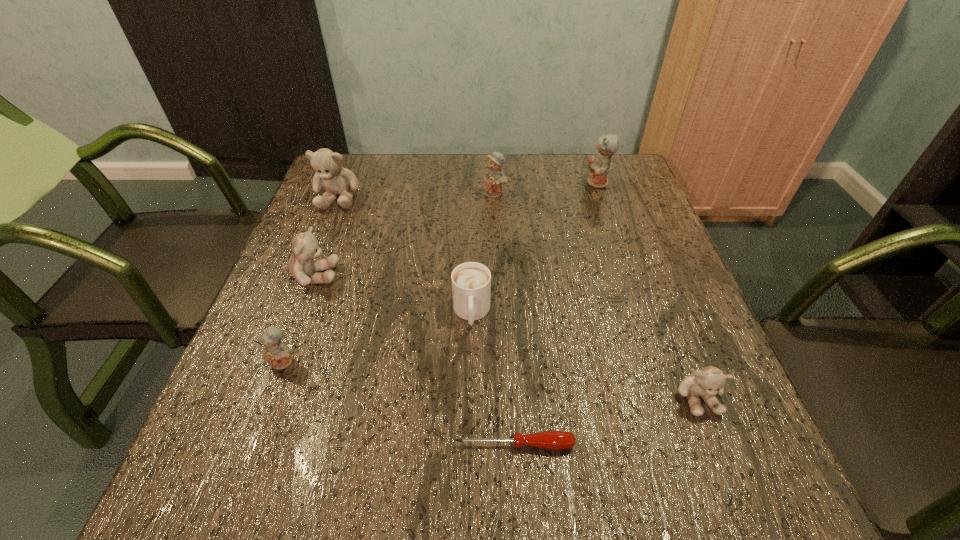
The width and height of the screenshot is (960, 540). I want to click on the nearest gray teddy bear, so click(707, 382).

Image resolution: width=960 pixels, height=540 pixels. What are the coordinates of `the smallest gray teddy bear` in the screenshot? It's located at (707, 382).

Image resolution: width=960 pixels, height=540 pixels. Identify the location of the nearest object. (554, 440).

This screenshot has width=960, height=540. In order to click on screwdriver in this screenshot , I will do `click(554, 440)`.

Find the location of a particular element. This screenshot has height=540, width=960. free point located 0.220m on the front-facing side of the biggest blue teddy bear is located at coordinates (509, 183).

Find the location of a particular element. blank space located on the front-facing side of the biggest blue teddy bear is located at coordinates (551, 183).

The image size is (960, 540). I want to click on free space located 0.260m on the front-facing side of the biggest blue teddy bear, so click(x=494, y=183).

This screenshot has height=540, width=960. I want to click on free region located 0.080m on the face of the farthest gray teddy bear, so click(x=324, y=233).

Locate an element on the screen. Image resolution: width=960 pixels, height=540 pixels. vacant area situated on the front-facing side of the fourth teddy bear from left to right is located at coordinates (499, 293).

I want to click on vacant region located on the face of the second nearest gray teddy bear, so click(x=393, y=275).